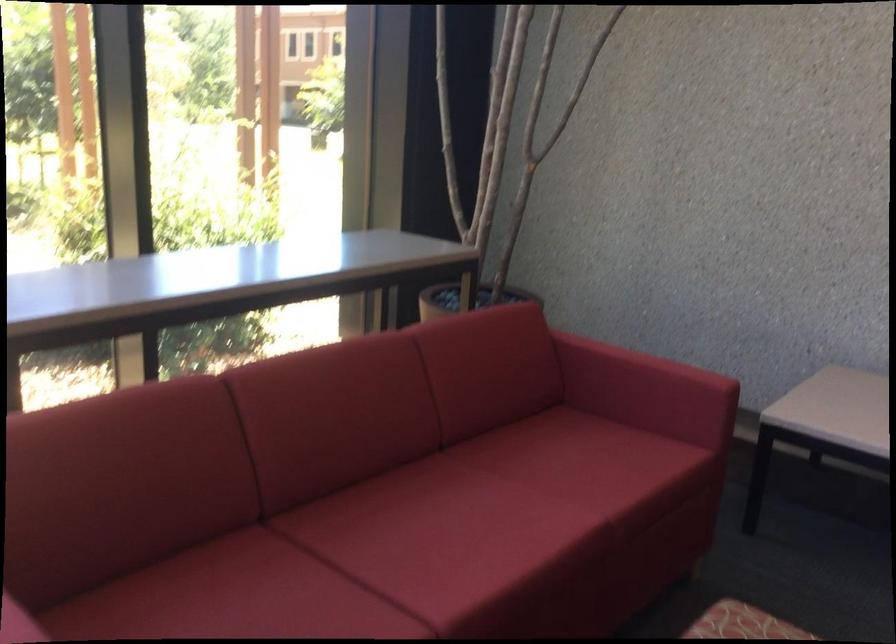
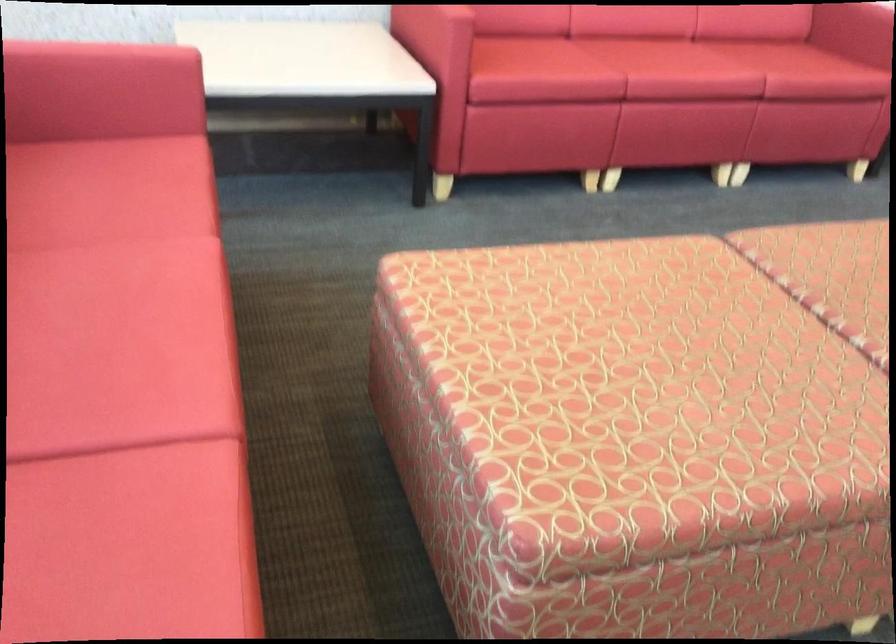
Find the pixel in the second image that matches the point at 659,365 in the first image.

(102, 53)